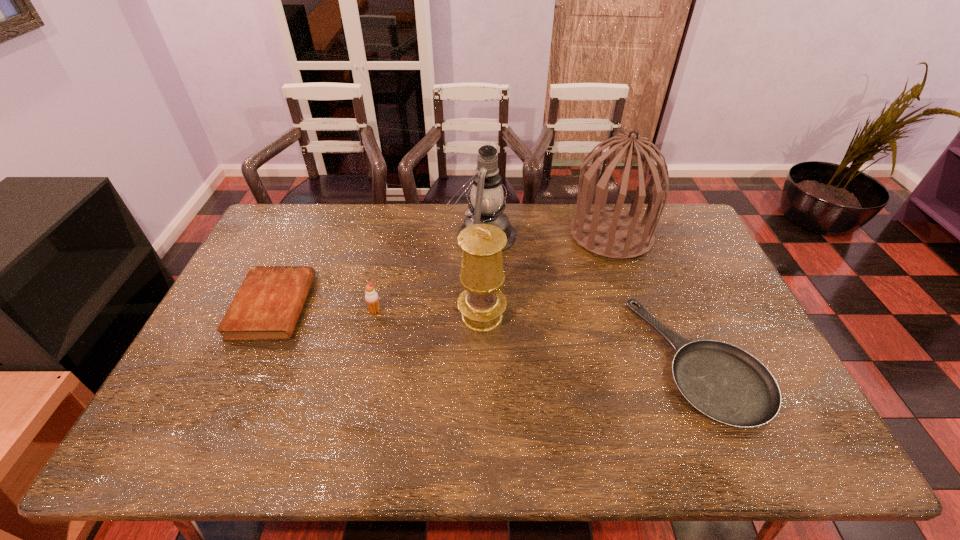
You are a GUI agent. You are given a task and a screenshot of the screen. Output one action in this format:
    pyautogui.click(x=<x>, y=<y>)
    Task: Click on the vacant space located on the right of the nearer oil lamp
    This screenshot has height=540, width=960.
    Given the screenshot: What is the action you would take?
    pyautogui.click(x=540, y=316)

I want to click on vacant area situated at the front with a straw on the second object from left to right, so click(x=367, y=346).

At what (x,y) coordinates should I click in order to perform the action: click on vacant area situated 0.300m on the spine side of the fifth tallest object. Please return your answer as a coordinate pair (x, y). Looking at the image, I should click on (405, 306).

Locate an element on the screen. This screenshot has width=960, height=540. vacant space located 0.150m on the left of the shortest object is located at coordinates (585, 360).

Image resolution: width=960 pixels, height=540 pixels. Identify the location of birdcage that is at the far edge. (609, 232).

Where is `oil lamp present at the far edge`? Image resolution: width=960 pixels, height=540 pixels. oil lamp present at the far edge is located at coordinates (486, 206).

Identify the location of object present at the near edge. (725, 383).

Where is `object located in the left edge section of the desktop`? object located in the left edge section of the desktop is located at coordinates (267, 306).

I want to click on birdcage positioned at the right edge, so pyautogui.click(x=609, y=232).

Find the location of `frying pan located in the right edge section of the desktop`. frying pan located in the right edge section of the desktop is located at coordinates (725, 383).